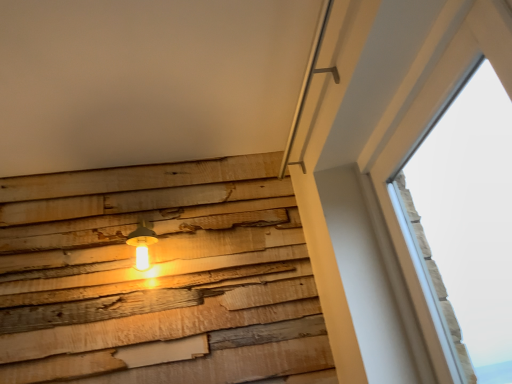
Question: Can you confirm if transparent glass window at upper right is bigger than matte yellow glass lamp at center-left?

Choices:
 (A) no
 (B) yes

Answer: (B)

Question: Would you say transparent glass window at upper right is a long distance from matte yellow glass lamp at center-left?

Choices:
 (A) no
 (B) yes

Answer: (B)

Question: From a real-world perspective, is transparent glass window at upper right below matte yellow glass lamp at center-left?

Choices:
 (A) yes
 (B) no

Answer: (A)

Question: Considering the relative sizes of transparent glass window at upper right and matte yellow glass lamp at center-left in the image provided, is transparent glass window at upper right taller than matte yellow glass lamp at center-left?

Choices:
 (A) yes
 (B) no

Answer: (A)

Question: Could you tell me if transparent glass window at upper right is facing matte yellow glass lamp at center-left?

Choices:
 (A) no
 (B) yes

Answer: (B)

Question: From a real-world perspective, is transparent glass window at upper right physically above matte yellow glass lamp at center-left?

Choices:
 (A) yes
 (B) no

Answer: (B)

Question: From a real-world perspective, does matte yellow glass lamp at center-left sit lower than transparent glass window at upper right?

Choices:
 (A) no
 (B) yes

Answer: (A)

Question: Is matte yellow glass lamp at center-left outside of transparent glass window at upper right?

Choices:
 (A) no
 (B) yes

Answer: (B)

Question: From the image's perspective, would you say matte yellow glass lamp at center-left is shown under transparent glass window at upper right?

Choices:
 (A) no
 (B) yes

Answer: (B)

Question: Can you confirm if matte yellow glass lamp at center-left is bigger than transparent glass window at upper right?

Choices:
 (A) no
 (B) yes

Answer: (A)

Question: From a real-world perspective, is matte yellow glass lamp at center-left over transparent glass window at upper right?

Choices:
 (A) yes
 (B) no

Answer: (A)

Question: Would you say matte yellow glass lamp at center-left is a long distance from transparent glass window at upper right?

Choices:
 (A) yes
 (B) no

Answer: (A)

Question: Considering the positions of point (148, 261) and point (480, 200), is point (148, 261) closer or farther from the camera than point (480, 200)?

Choices:
 (A) farther
 (B) closer

Answer: (B)